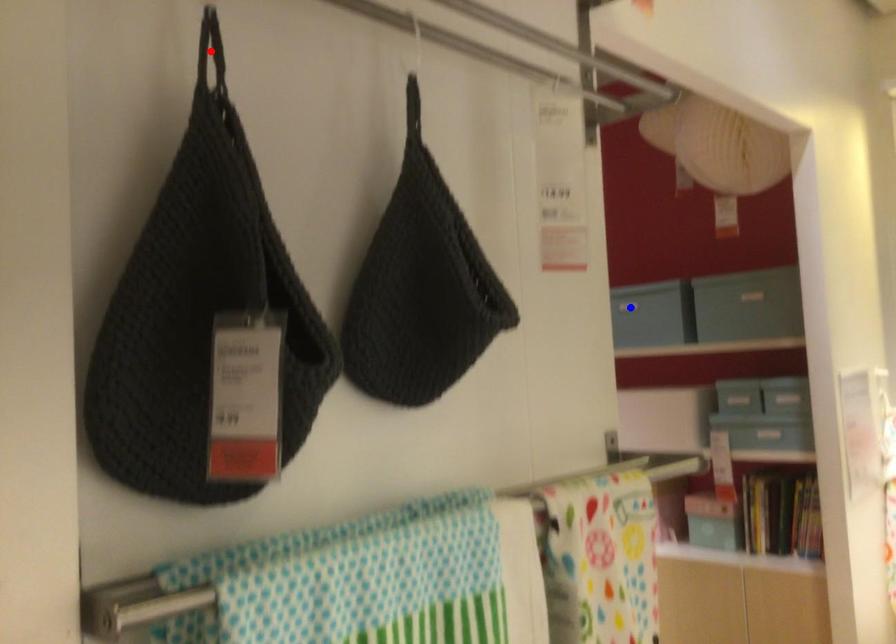
Question: Two points are marked on the image. Which point is closer to the camera?

Choices:
 (A) Blue point is closer.
 (B) Red point is closer.

Answer: (B)